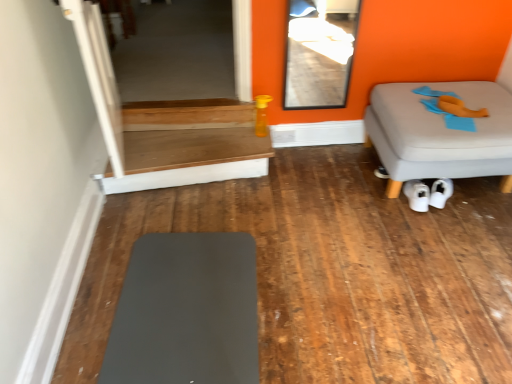
Identify the location of vacant area that is in front of white matte sneakers at lower center. Image resolution: width=512 pixels, height=384 pixels. (424, 224).